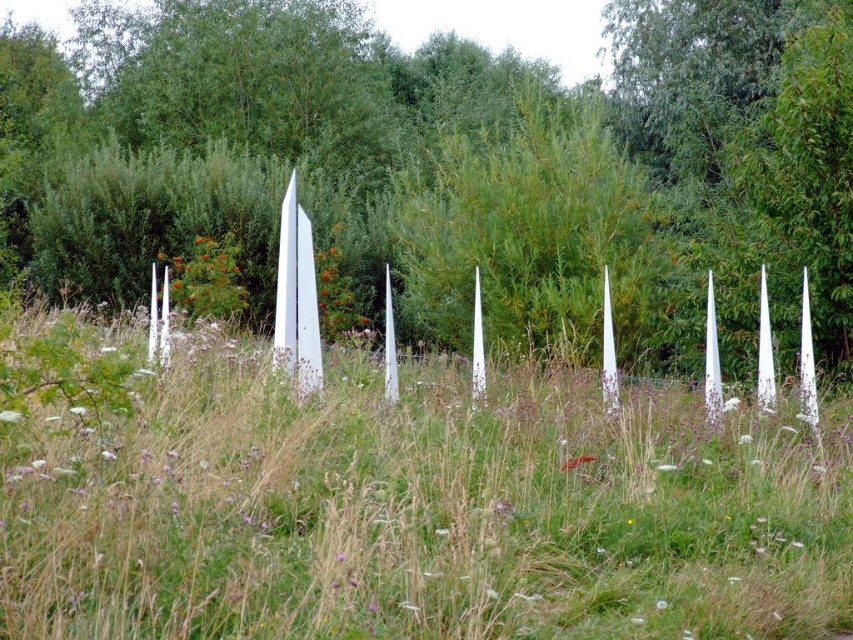
Question: Which object is closer to the camera taking this photo?

Choices:
 (A) green grass at center
 (B) green leafy tree at center

Answer: (A)

Question: Which point is farther from the camera taking this photo?

Choices:
 (A) (399, 625)
 (B) (271, 353)

Answer: (B)

Question: Is green leafy tree at center wider than white glossy blade at center?

Choices:
 (A) yes
 (B) no

Answer: (A)

Question: Does green grass at center lie behind white glossy blade at center?

Choices:
 (A) yes
 (B) no

Answer: (B)

Question: Estimate the real-world distances between objects in this image. Which object is farther from the green grass at center?

Choices:
 (A) white glossy blade at center
 (B) green leafy tree at center

Answer: (B)

Question: Is green leafy tree at center above green grass at center?

Choices:
 (A) no
 (B) yes

Answer: (B)